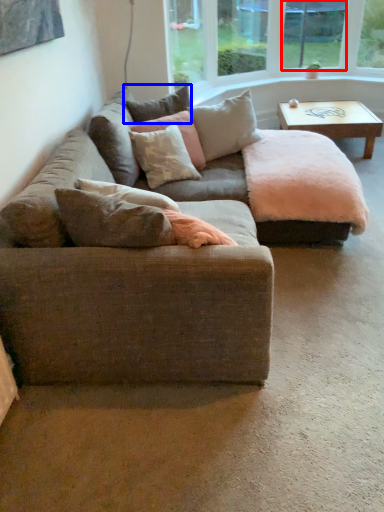
Question: Which object is closer to the camera taking this photo, window screen (highlighted by a red box) or pillow (highlighted by a blue box)?

Choices:
 (A) window screen
 (B) pillow

Answer: (B)